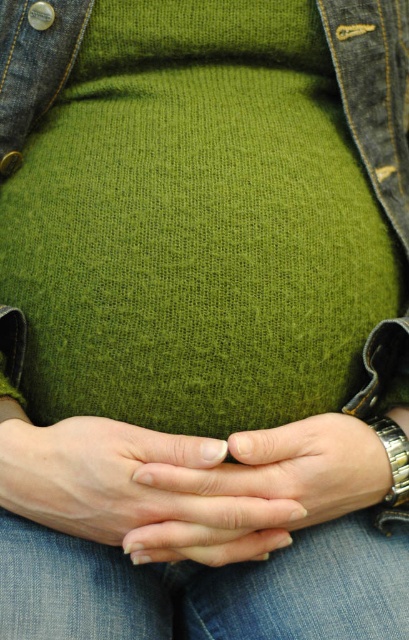
You are a tailor measuring a customer for a new sweater. You notice the matte green sweater at center and the smooth skin hands at center. Based on their sizes, can the current sweater accommodate the hands when the customer moves them freely?

The matte green sweater at center has a larger size compared to smooth skin hands at center, so yes, the sweater can accommodate the hands when the customer moves them freely since it is bigger than the hands.

You are a fashion designer trying to create a new outfit. You see the blue denim jeans at lower center and the matte green sweater at center in the image. Which clothing item is placed lower on the body?

The blue denim jeans at lower center is positioned under the matte green sweater at center, so it is placed lower on the body.